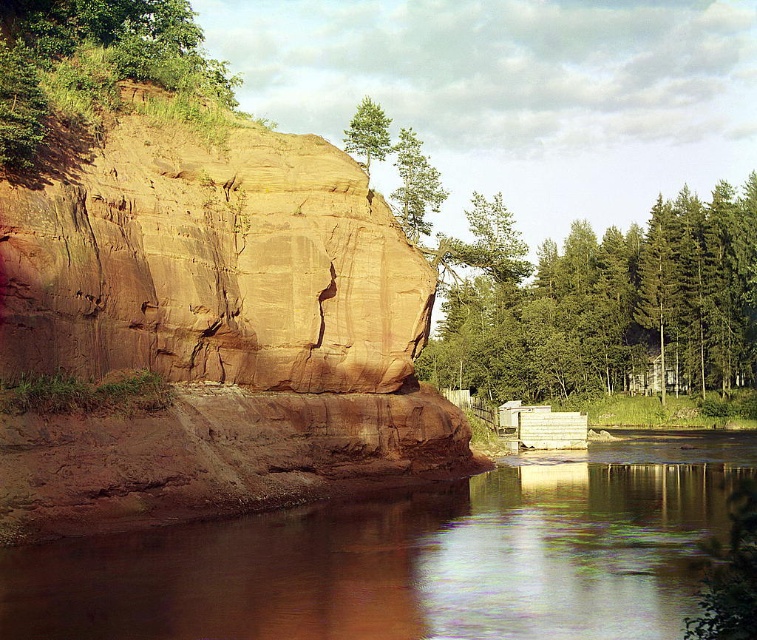
Does green leafy tree at upper left come in front of green matte tree at upper center?

Yes, green leafy tree at upper left is in front of green matte tree at upper center.

Is green leafy tree at upper left taller than green matte tree at upper center?

No, green leafy tree at upper left is not taller than green matte tree at upper center.

Measure the distance between green leafy tree at upper left and camera.

green leafy tree at upper left is 52.79 meters away from camera.

The height and width of the screenshot is (640, 757). I want to click on green leafy tree at upper left, so click(x=92, y=70).

Describe the element at coordinates (207, 333) in the screenshot. The height and width of the screenshot is (640, 757). I see `brown rough rock face at upper left` at that location.

Who is shorter, brown rough rock face at upper left or green leafy trees at right?

brown rough rock face at upper left is shorter.

Which is in front, point (354, 388) or point (643, 269)?

Positioned in front is point (354, 388).

Where is `brown rough rock face at upper left`? brown rough rock face at upper left is located at coordinates [207, 333].

The height and width of the screenshot is (640, 757). Describe the element at coordinates (207, 333) in the screenshot. I see `brown rough rock face at upper left` at that location.

Who is higher up, brown rough rock face at upper left or green leafy tree at upper left?

green leafy tree at upper left is higher up.

Is point (134, 330) closer to camera compared to point (75, 40)?

That is True.

Find the location of a particular element. This screenshot has width=757, height=640. brown rough rock face at upper left is located at coordinates (207, 333).